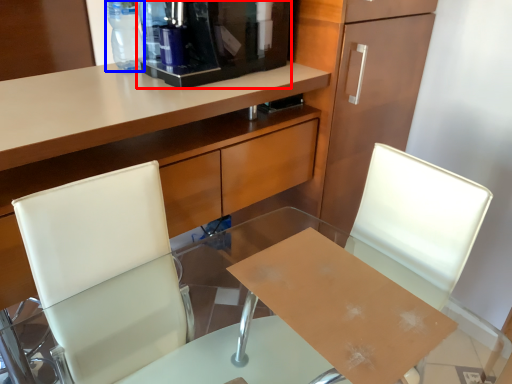
Question: Which of the following is the closest to the observer, coffee machine (highlighted by a red box) or bottle (highlighted by a blue box)?

Choices:
 (A) coffee machine
 (B) bottle

Answer: (A)